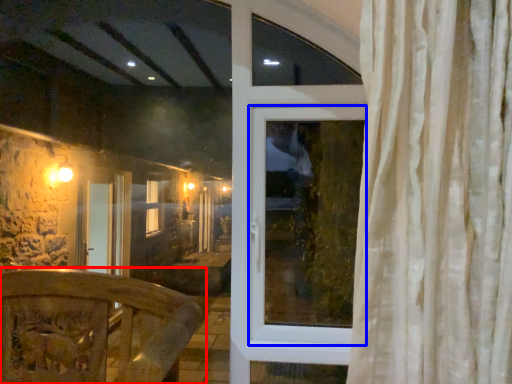
Question: Which of the following is the farthest to the observer, furniture (highlighted by a red box) or window (highlighted by a blue box)?

Choices:
 (A) furniture
 (B) window

Answer: (B)